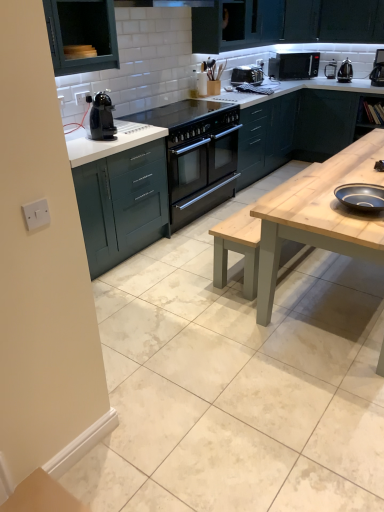
Identify the location of dark teal wood cabinet at upper right, the 4th cabinetry positioned from the left. The width and height of the screenshot is (384, 512). (323, 123).

Find the location of a particular element. black metallic kettle at upper right, which is the 3th appliance from left to right is located at coordinates (345, 71).

Based on the photo, how much space does matte blue bowl at center, placed as the third appliance when sorted from back to front, occupy vertically?

The height of matte blue bowl at center, placed as the third appliance when sorted from back to front, is 2.63 inches.

In order to face natural wood table at center, should I rotate leftwards or rightwards?

A 24.034 degree turn to the right will do.

The height and width of the screenshot is (512, 384). In order to click on green matte cabinet at upper center, the third cabinetry positioned from the left in this screenshot , I will do `click(285, 23)`.

Where is `dark teal wood cabinet at upper right, arranged as the 1th cabinetry when viewed from the right`? dark teal wood cabinet at upper right, arranged as the 1th cabinetry when viewed from the right is located at coordinates (323, 123).

Does point (158, 204) appear closer or farther from the camera than point (66, 26)?

Point (158, 204) appears to be farther away from the viewer than point (66, 26).

Based on the photo, does teal matte cabinet at left, marked as the second cabinetry in a left-to-right arrangement, have a greater width compared to teal wood cabinet at upper left, which is the 4th cabinetry in right-to-left order?

Indeed, teal matte cabinet at left, marked as the second cabinetry in a left-to-right arrangement, has a greater width compared to teal wood cabinet at upper left, which is the 4th cabinetry in right-to-left order.

Does teal matte cabinet at left, which is counted as the 3th cabinetry, starting from the right, contain teal wood cabinet at upper left, arranged as the 1th cabinetry when viewed from the left?

No, teal wood cabinet at upper left, arranged as the 1th cabinetry when viewed from the left, is not a part of teal matte cabinet at left, which is counted as the 3th cabinetry, starting from the right.

Considering the sizes of objects teal matte cabinet at left, which is counted as the 3th cabinetry, starting from the right, and teal wood cabinet at upper left, arranged as the 1th cabinetry when viewed from the left, in the image provided, who is shorter, teal matte cabinet at left, which is counted as the 3th cabinetry, starting from the right, or teal wood cabinet at upper left, arranged as the 1th cabinetry when viewed from the left,?

teal wood cabinet at upper left, arranged as the 1th cabinetry when viewed from the left.

Relative to teal matte cabinet at left, marked as the second cabinetry in a left-to-right arrangement, is teal wood cabinet at upper left, arranged as the 1th cabinetry when viewed from the left, in front or behind?

Clearly, teal wood cabinet at upper left, arranged as the 1th cabinetry when viewed from the left, is in front of teal matte cabinet at left, marked as the second cabinetry in a left-to-right arrangement.

Is teal wood cabinet at upper left, arranged as the 1th cabinetry when viewed from the left, looking in the opposite direction of teal matte cabinet at left, which is counted as the 3th cabinetry, starting from the right?

That's not correct — teal wood cabinet at upper left, arranged as the 1th cabinetry when viewed from the left, is not looking away from teal matte cabinet at left, which is counted as the 3th cabinetry, starting from the right.

From the picture: Can you confirm if teal wood cabinet at upper left, which is the 4th cabinetry in right-to-left order, is bigger than teal matte cabinet at left, marked as the second cabinetry in a left-to-right arrangement?

No.

Is teal matte cabinet at left, which is counted as the 3th cabinetry, starting from the right, located within teal wood cabinet at upper left, which is the 4th cabinetry in right-to-left order?

Definitely not — teal matte cabinet at left, which is counted as the 3th cabinetry, starting from the right, is not inside teal wood cabinet at upper left, which is the 4th cabinetry in right-to-left order.

At what (x,y) coordinates should I click in order to perform the action: click on kitchen appliance to the left of black glass cooktop at center. Please return your answer as a coordinate pair (x, y). The width and height of the screenshot is (384, 512). Looking at the image, I should click on (101, 117).

Who is more distant, black glass cooktop at center or black plastic coffee machine at upper left?

black glass cooktop at center is more distant.

Are black glass cooktop at center and black plastic coffee machine at upper left far apart?

black glass cooktop at center is near black plastic coffee machine at upper left, not far away.

From the image's perspective, which one is positioned higher, black glass cooktop at center or black plastic coffee machine at upper left?

black glass cooktop at center is shown above in the image.

Is green matte cabinet at upper center, the third cabinetry positioned from the left, far from black metallic kettle at upper right, the 1th appliance when ordered from back to front?

Actually, green matte cabinet at upper center, the third cabinetry positioned from the left, and black metallic kettle at upper right, the 1th appliance when ordered from back to front, are a little close together.

What's the angular difference between green matte cabinet at upper center, the 2th cabinetry positioned from the right, and black metallic kettle at upper right, which is the 3th appliance in front-to-back order,'s facing directions?

They differ by 85.1 degrees in their facing directions.

Can you confirm if green matte cabinet at upper center, the 2th cabinetry positioned from the right, is positioned to the right of black metallic kettle at upper right, the 1th appliance positioned from the right?

Incorrect, green matte cabinet at upper center, the 2th cabinetry positioned from the right, is not on the right side of black metallic kettle at upper right, the 1th appliance positioned from the right.

At what (x,y) coordinates should I click in order to perform the action: click on the 1st appliance below the green matte cabinet at upper center, the third cabinetry positioned from the left (from a real-world perspective). Please return your answer as a coordinate pair (x, y). Looking at the image, I should click on (345, 71).

Does black plastic coffee machine at upper right appear on the left side of teal matte cabinet at left, marked as the second cabinetry in a left-to-right arrangement?

Incorrect, black plastic coffee machine at upper right is not on the left side of teal matte cabinet at left, marked as the second cabinetry in a left-to-right arrangement.

From the image's perspective, is black plastic coffee machine at upper right beneath teal matte cabinet at left, which is counted as the 3th cabinetry, starting from the right?

No.

Consider the image. Is black plastic coffee machine at upper right positioned with its back to teal matte cabinet at left, marked as the second cabinetry in a left-to-right arrangement?

No, black plastic coffee machine at upper right is not facing the opposite direction of teal matte cabinet at left, marked as the second cabinetry in a left-to-right arrangement.

From a real-world perspective, is black plastic coffee machine at upper right physically above teal matte cabinet at left, which is counted as the 3th cabinetry, starting from the right?

Yes, from a real-world perspective, black plastic coffee machine at upper right is above teal matte cabinet at left, which is counted as the 3th cabinetry, starting from the right.

Is dark teal wood cabinet at upper right, the 4th cabinetry positioned from the left, not close to matte blue bowl at center, the first appliance when ordered from bottom to top?

dark teal wood cabinet at upper right, the 4th cabinetry positioned from the left, is positioned a significant distance from matte blue bowl at center, the first appliance when ordered from bottom to top.

Could you tell me if dark teal wood cabinet at upper right, arranged as the 1th cabinetry when viewed from the right, is facing matte blue bowl at center, the 1th appliance when ordered from front to back?

Yes, dark teal wood cabinet at upper right, arranged as the 1th cabinetry when viewed from the right, is turned towards matte blue bowl at center, the 1th appliance when ordered from front to back.

Would you say matte blue bowl at center, placed as the third appliance when sorted from back to front, is part of dark teal wood cabinet at upper right, arranged as the 1th cabinetry when viewed from the right,'s contents?

That's incorrect, matte blue bowl at center, placed as the third appliance when sorted from back to front, is not inside dark teal wood cabinet at upper right, arranged as the 1th cabinetry when viewed from the right.

In terms of width, does dark teal wood cabinet at upper right, arranged as the 1th cabinetry when viewed from the right, look wider or thinner when compared to matte blue bowl at center, the 1th appliance when ordered from front to back?

Considering their sizes, dark teal wood cabinet at upper right, arranged as the 1th cabinetry when viewed from the right, looks broader than matte blue bowl at center, the 1th appliance when ordered from front to back.

Considering the relative sizes of black metallic kettle at upper right, which is the 3th appliance from left to right, and black plastic coffee machine at upper right in the image provided, is black metallic kettle at upper right, which is the 3th appliance from left to right, shorter than black plastic coffee machine at upper right?

Yes, black metallic kettle at upper right, which is the 3th appliance from left to right, is shorter than black plastic coffee machine at upper right.

Is black metallic kettle at upper right, the 1th appliance positioned from the right, placed right next to black plastic coffee machine at upper right?

black metallic kettle at upper right, the 1th appliance positioned from the right, and black plastic coffee machine at upper right are clearly separated.

Between black metallic kettle at upper right, the 1th appliance when ordered from back to front, and black plastic coffee machine at upper right, which one has smaller width?

black metallic kettle at upper right, the 1th appliance when ordered from back to front, is thinner.

The height and width of the screenshot is (512, 384). What are the coordinates of `cabinetry to the left of teal matte cabinet at left, which is counted as the 3th cabinetry, starting from the right` in the screenshot? It's located at (81, 35).

Where is `cabinetry below the teal wood cabinet at upper left, arranged as the 1th cabinetry when viewed from the left (from the image's perspective)`? cabinetry below the teal wood cabinet at upper left, arranged as the 1th cabinetry when viewed from the left (from the image's perspective) is located at coordinates (122, 204).

Based on their spatial positions, is teal wood cabinet at upper left, arranged as the 1th cabinetry when viewed from the left, or black metallic kettle at upper right, which is the 3th appliance in front-to-back order, closer to matte blue bowl at center, the 1th appliance when ordered from front to back?

The object closer to matte blue bowl at center, the 1th appliance when ordered from front to back, is teal wood cabinet at upper left, arranged as the 1th cabinetry when viewed from the left.

From the image, which object appears to be nearer to matte blue bowl at center, placed as the third appliance when sorted from back to front, dark teal wood cabinet at upper right, the 4th cabinetry positioned from the left, or black matte microwave at upper right?

Based on the image, dark teal wood cabinet at upper right, the 4th cabinetry positioned from the left, appears to be nearer to matte blue bowl at center, placed as the third appliance when sorted from back to front.

When comparing their distances from black metallic kettle at upper right, the 1th appliance positioned from the right, does black plastic toaster at center, the first appliance in the left-to-right sequence, or teal wood cabinet at upper left, arranged as the 1th cabinetry when viewed from the left, seem closer?

black plastic toaster at center, the first appliance in the left-to-right sequence, is closer to black metallic kettle at upper right, the 1th appliance positioned from the right.

When comparing their distances from black matte microwave at upper right, does black plastic coffee machine at upper right or matte blue bowl at center, the first appliance when ordered from bottom to top, seem closer?

Based on the image, black plastic coffee machine at upper right appears to be nearer to black matte microwave at upper right.

Which object lies nearer to the anchor point black matte microwave at upper right, black plastic coffee machine at upper left or natural wood table at center?

natural wood table at center lies closer to black matte microwave at upper right than the other object.

Which object lies further to the anchor point black plastic toaster at center, the 2th appliance viewed from the front, matte blue bowl at center, the second appliance viewed from the left, or teal wood cabinet at upper left, arranged as the 1th cabinetry when viewed from the left?

matte blue bowl at center, the second appliance viewed from the left, is positioned further to the anchor black plastic toaster at center, the 2th appliance viewed from the front.

Which object lies further to the anchor point black plastic coffee machine at upper left, teal wood cabinet at upper left, arranged as the 1th cabinetry when viewed from the left, or black glass cooktop at center?

black glass cooktop at center is positioned further to the anchor black plastic coffee machine at upper left.

Which object lies nearer to the anchor point black plastic coffee machine at upper left, green matte cabinet at upper center, the third cabinetry positioned from the left, or black metallic kettle at upper right, the 1th appliance when ordered from back to front?

The object closer to black plastic coffee machine at upper left is green matte cabinet at upper center, the third cabinetry positioned from the left.

I want to click on appliance between natural wood table at center and black plastic toaster at center, the 2th appliance viewed from the front, in the front-back direction, so click(x=361, y=196).

Locate an element on the screen. This screenshot has height=512, width=384. kitchen appliance located between natural wood table at center and black plastic toaster at center, which appears as the 3th appliance when viewed from the right, in the depth direction is located at coordinates (101, 117).

The height and width of the screenshot is (512, 384). Identify the location of coffee machine positioned between matte blue bowl at center, placed as the third appliance when sorted from back to front, and dark teal wood cabinet at upper right, the 4th cabinetry positioned from the left, from near to far. (378, 69).

Locate an element on the screen. coffee machine positioned between matte blue bowl at center, the first appliance when ordered from bottom to top, and black metallic kettle at upper right, the 1th appliance when ordered from back to front, from near to far is located at coordinates (378, 69).